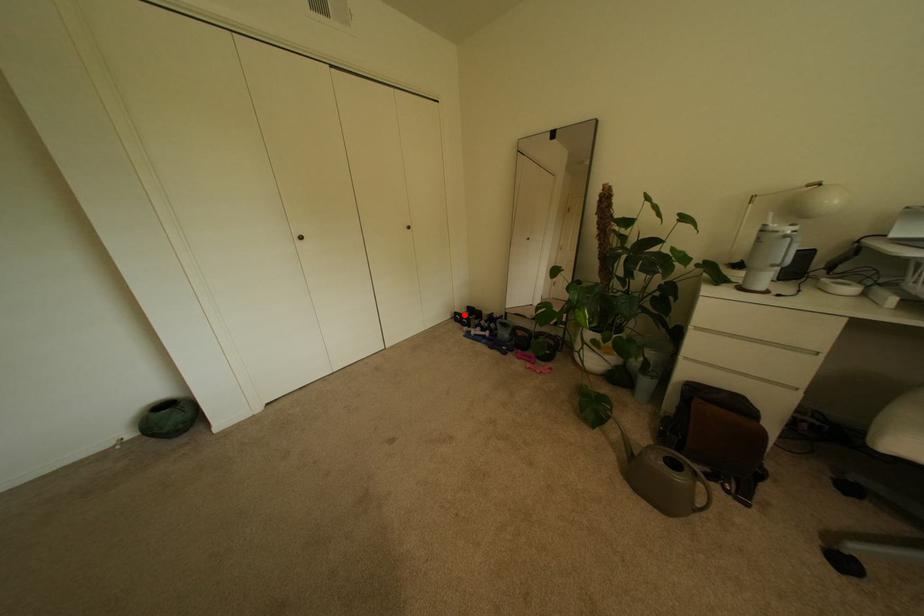
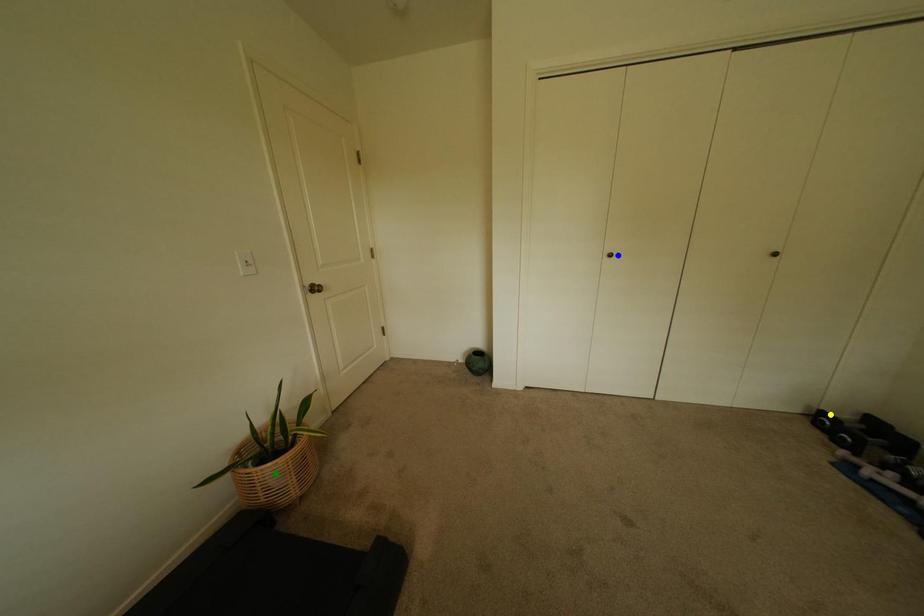
Question: I am providing you with two images of the same scene from different viewpoints. A red point is marked on the first image. You are given multiple points on the second image. Can you choose the point in image 2 that corresponds to the point in image 1?

Choices:
 (A) yellow point
 (B) green point
 (C) blue point

Answer: (A)